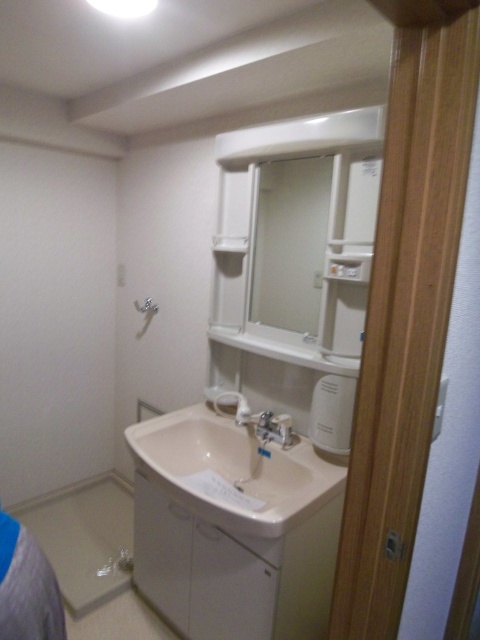
Question: Which point is closer to the camera?

Choices:
 (A) (239, 435)
 (B) (269, 428)
 (C) (144, 301)

Answer: (B)

Question: Is white glossy sink at center to the right of satin nickel faucet at sink center from the viewer's perspective?

Choices:
 (A) yes
 (B) no

Answer: (B)

Question: Which of the following is the farthest from the observer?

Choices:
 (A) (184, 477)
 (B) (142, 308)

Answer: (B)

Question: Is satin nickel faucet at sink center thinner than matte white shower at upper center?

Choices:
 (A) yes
 (B) no

Answer: (A)

Question: Does satin nickel faucet at sink center have a smaller size compared to matte white shower at upper center?

Choices:
 (A) yes
 (B) no

Answer: (B)

Question: Which point is closer to the camera?

Choices:
 (A) (178, 460)
 (B) (148, 304)
 (C) (263, 426)

Answer: (C)